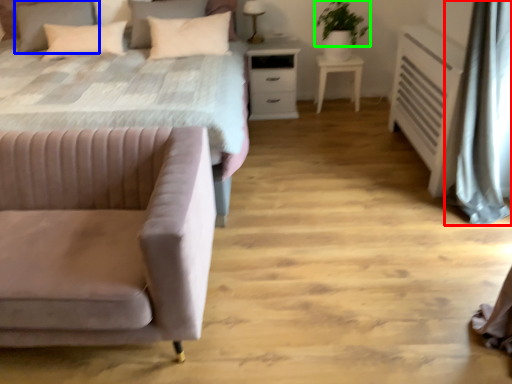
Question: Which object is positioned closest to curtain (highlighted by a red box)? Select from pillow (highlighted by a blue box) and plant (highlighted by a green box).

Choices:
 (A) pillow
 (B) plant

Answer: (B)